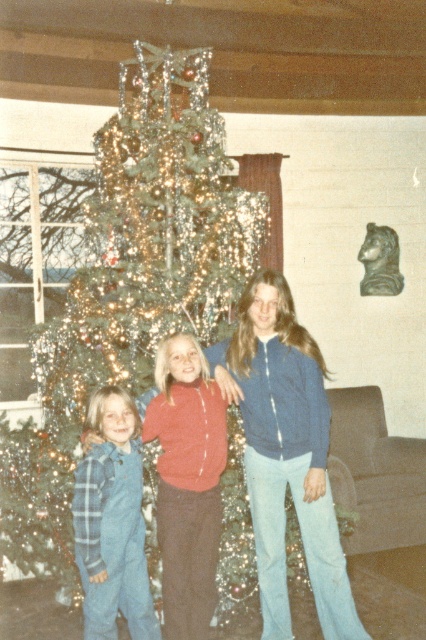
Is green shiny christmas tree at center behind blue plaid overalls at lower left?

Yes.

Locate an element on the screen. green shiny christmas tree at center is located at coordinates (131, 282).

This screenshot has width=426, height=640. Find the location of `green shiny christmas tree at center`. green shiny christmas tree at center is located at coordinates (131, 282).

Can you confirm if blue denim jacket at center is positioned to the left of blue corduroy pants at lower left?

No, blue denim jacket at center is not to the left of blue corduroy pants at lower left.

Which is in front, point (247, 305) or point (173, 588)?

Point (173, 588) is more forward.

Between point (311, 550) and point (169, 422), which one is positioned in front?

Point (169, 422)

What are the coordinates of `blue denim jacket at center` in the screenshot? It's located at (285, 452).

Does blue corduroy pants at lower left have a lesser width compared to blue plaid overalls at lower left?

No.

Which is in front, point (161, 346) or point (92, 481)?

Point (92, 481) is in front.

Where is `blue corduroy pants at lower left`? This screenshot has width=426, height=640. blue corduroy pants at lower left is located at coordinates (187, 481).